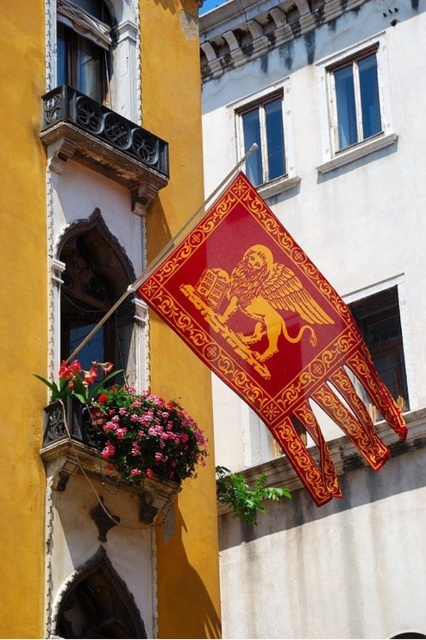
Question: In this image, where is shiny red fabric flag at center located relative to pink fabric flower at lower left?

Choices:
 (A) right
 (B) left

Answer: (A)

Question: Which object is closer to the camera taking this photo?

Choices:
 (A) pink fabric flower at lower left
 (B) shiny red fabric flag at center
 (C) wooden flower box at lower left

Answer: (B)

Question: Is pink fabric flower at lower left to the left of wooden flower box at lower left from the viewer's perspective?

Choices:
 (A) no
 (B) yes

Answer: (A)

Question: Which object is the closest to the pink fabric flower at lower left?

Choices:
 (A) shiny red fabric flag at center
 (B) wooden flower box at lower left

Answer: (B)

Question: Which object is closer to the camera taking this photo?

Choices:
 (A) wooden flower box at lower left
 (B) shiny red fabric flag at center
 (C) pink fabric flower at lower left

Answer: (B)

Question: Does shiny red fabric flag at center have a larger size compared to pink fabric flower at lower left?

Choices:
 (A) no
 (B) yes

Answer: (B)